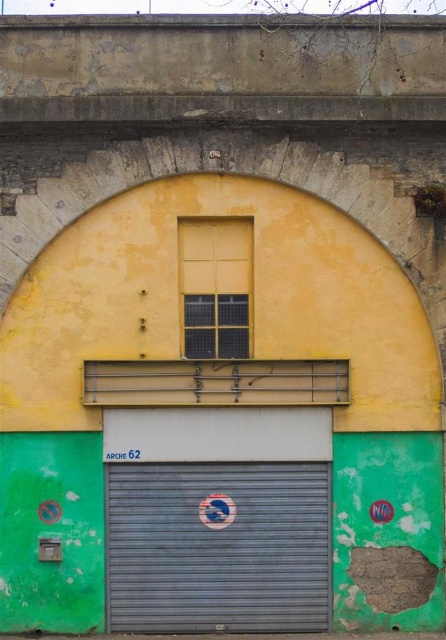
Question: In this image, where is metallic gray garage door at center located relative to yellow matte window at upper center?

Choices:
 (A) above
 (B) below

Answer: (B)

Question: Which object is closer to the camera taking this photo?

Choices:
 (A) yellow matte window at upper center
 (B) metallic gray garage door at center

Answer: (B)

Question: Which point is farther to the camera?

Choices:
 (A) [x=242, y=545]
 (B) [x=214, y=310]

Answer: (B)

Question: Which point is closer to the camera?

Choices:
 (A) metallic gray garage door at center
 (B) yellow matte window at upper center

Answer: (A)

Question: Is metallic gray garage door at center further to the viewer compared to yellow matte window at upper center?

Choices:
 (A) yes
 (B) no

Answer: (B)

Question: Can you confirm if metallic gray garage door at center is positioned below yellow matte window at upper center?

Choices:
 (A) no
 (B) yes

Answer: (B)